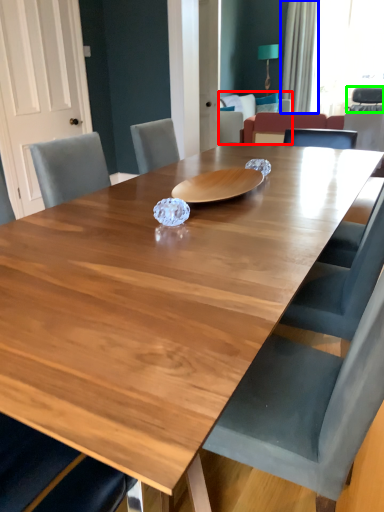
Question: Which object is positioned farthest from armchair (highlighted by a red box)? Select from curtain (highlighted by a blue box) and armchair (highlighted by a green box).

Choices:
 (A) curtain
 (B) armchair

Answer: (B)